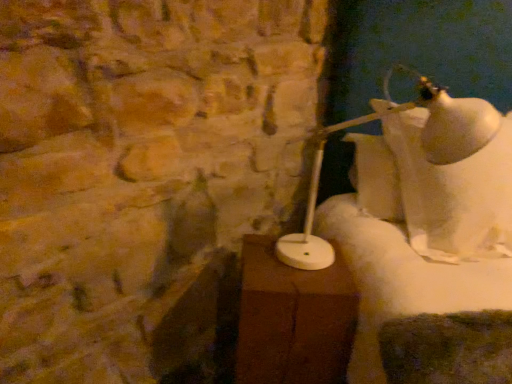
The height and width of the screenshot is (384, 512). Find the location of `blank space above brown wood table at center (from a real-world perspective)`. blank space above brown wood table at center (from a real-world perspective) is located at coordinates (292, 272).